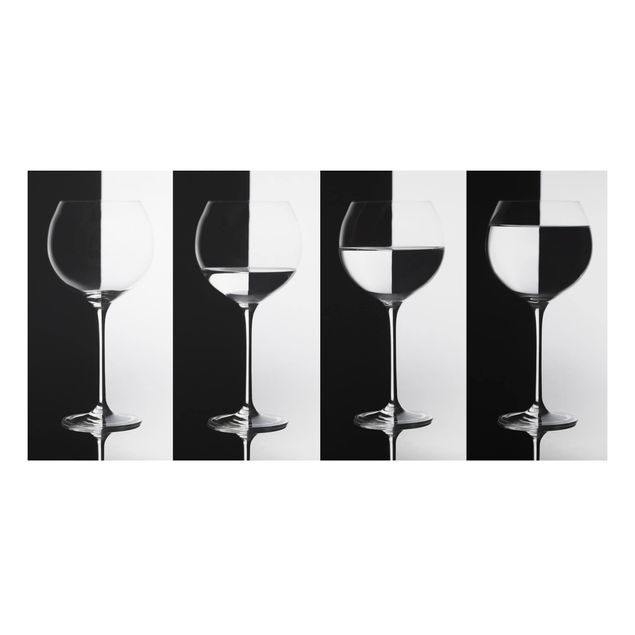
Find the location of a particular element. The width and height of the screenshot is (635, 635). number of wine glasses is located at coordinates (109, 250), (229, 258), (376, 258), (526, 262).